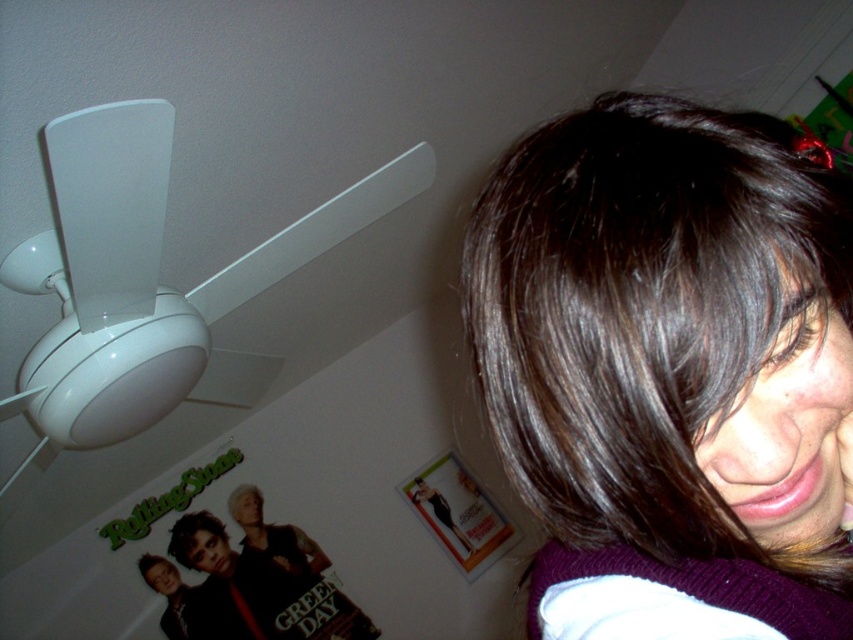
Question: Among these objects, which one is nearest to the camera?

Choices:
 (A) matte black band poster at upper left
 (B) white matte ceiling fan at upper left

Answer: (B)

Question: Is dark brown hair at upper right positioned before white matte ceiling fan at upper left?

Choices:
 (A) no
 (B) yes

Answer: (B)

Question: Which point appears farthest from the camera in this image?

Choices:
 (A) (218, 630)
 (B) (329, 220)

Answer: (A)

Question: Which object is closer to the camera taking this photo?

Choices:
 (A) matte black band poster at upper left
 (B) dark brown hair at upper right

Answer: (B)

Question: Can you confirm if dark brown hair at upper right is positioned to the left of white matte ceiling fan at upper left?

Choices:
 (A) yes
 (B) no

Answer: (B)

Question: Does dark brown hair at upper right come behind white matte ceiling fan at upper left?

Choices:
 (A) yes
 (B) no

Answer: (B)